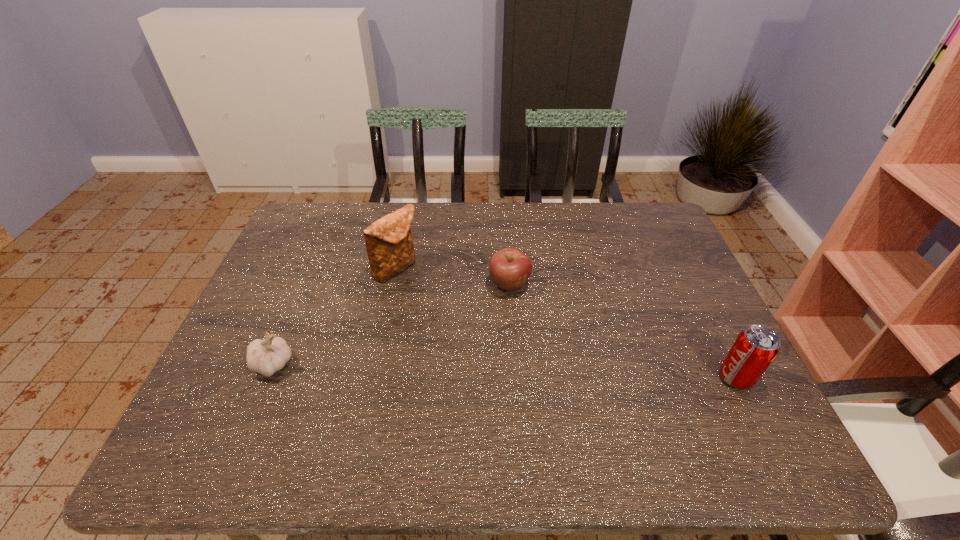
You are a GUI agent. You are given a task and a screenshot of the screen. Output one action in this format:
    pyautogui.click(x=<x>, y=<y>)
    Task: Click on the free space between the second tallest object and the apple
    This screenshot has width=960, height=540.
    Given the screenshot: What is the action you would take?
    pyautogui.click(x=623, y=330)

Where is `free spot between the second object from left to right and the apple`? The height and width of the screenshot is (540, 960). free spot between the second object from left to right and the apple is located at coordinates (453, 276).

Locate an element on the screen. free space between the rightmost object and the third object from left to right is located at coordinates coord(623,330).

This screenshot has width=960, height=540. I want to click on vacant area that lies between the shortest object and the soda can, so click(x=623, y=330).

At what (x,y) coordinates should I click in order to perform the action: click on unoccupied position between the rightmost object and the leftmost object. Please return your answer as a coordinate pair (x, y). The width and height of the screenshot is (960, 540). Looking at the image, I should click on (504, 371).

Find the location of a particular element. The width and height of the screenshot is (960, 540). free space between the clutch bag and the second shortest object is located at coordinates (334, 317).

Image resolution: width=960 pixels, height=540 pixels. I want to click on the third closest object to the tallest object, so click(x=754, y=349).

Where is `object that stands as the second closest to the second object from right to left`? The height and width of the screenshot is (540, 960). object that stands as the second closest to the second object from right to left is located at coordinates coord(754,349).

Find the location of a particular element. The height and width of the screenshot is (540, 960). blank area in the image that satisfies the following two spatial constraints: 1. on the front side of the third object from right to left; 2. on the left side of the second tallest object is located at coordinates (373, 378).

The height and width of the screenshot is (540, 960). I want to click on vacant space that satisfies the following two spatial constraints: 1. on the back side of the garlic; 2. on the right side of the shortest object, so click(x=306, y=284).